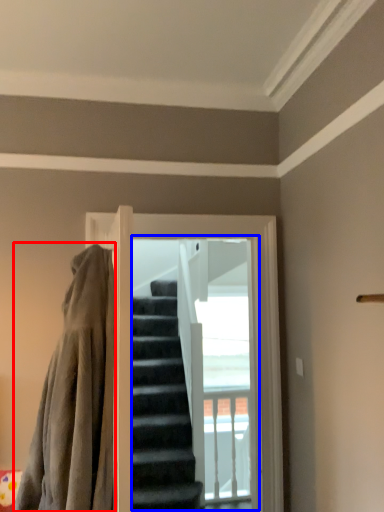
Question: Which object appears farthest to the camera in this image, blanket (highlighted by a red box) or screen door (highlighted by a blue box)?

Choices:
 (A) blanket
 (B) screen door

Answer: (B)